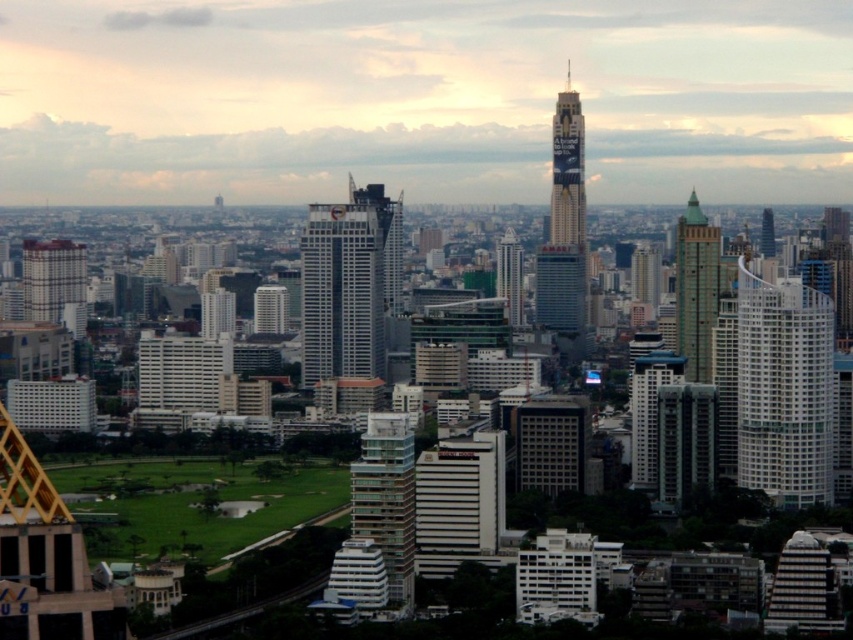
You are an architect evaluating the city skyline. You notice the white glass skyscraper at center and the green glass tower at right. Which one is positioned higher in the sky?

The white glass skyscraper at center is positioned higher in the sky than the green glass tower at right.

You are a pilot preparing to land a small plane at an airport located near the city. You need to avoid tall structures. Based on the scene, which of the two buildings, the white glass building at right or the green glass skyscraper at center, should you be more cautious of due to its height?

The white glass building at right has a greater height compared to the green glass skyscraper at center, so pilots should be more cautious of the white glass building at right when landing to avoid collisions.